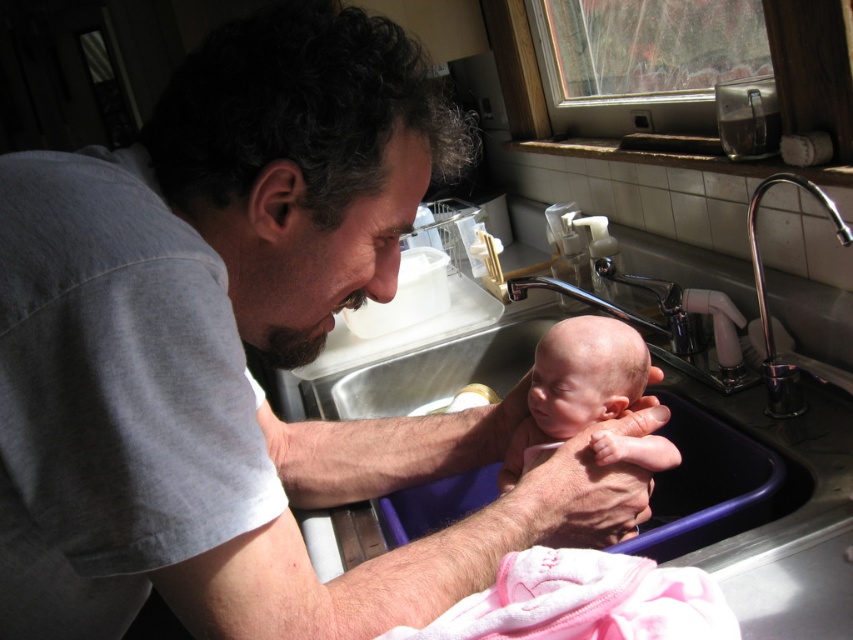
Is the position of smooth skin newborn at center less distant than that of chrome metallic faucet at sink right?

No, smooth skin newborn at center is further to the viewer.

Can you confirm if smooth skin newborn at center is positioned to the right of chrome metallic faucet at sink right?

No, smooth skin newborn at center is not to the right of chrome metallic faucet at sink right.

Is point (560, 339) behind point (834, 204)?

Yes.

Locate an element on the screen. smooth skin newborn at center is located at coordinates (578, 384).